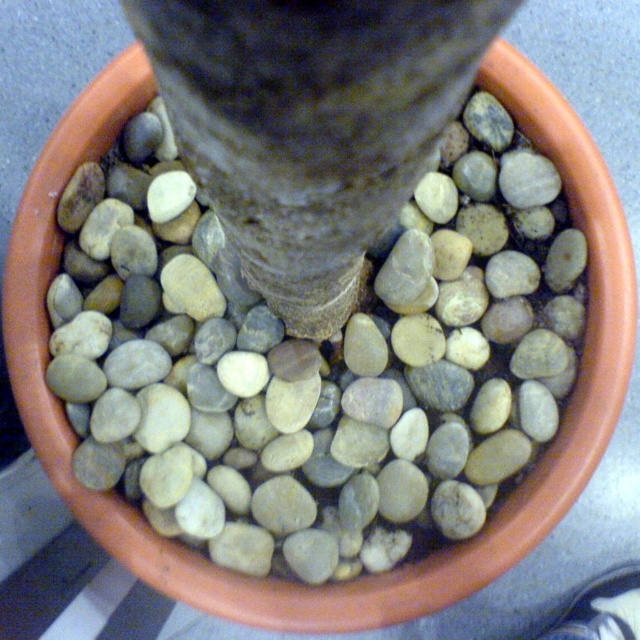
Based on the photo, you are a geologist examining the terracotta pot. You notice two objects at the center of the pot. Which one is taller, the smooth gray pebble at center or the smooth gray bark at center?

The smooth gray pebble at center is taller than the smooth gray bark at center according to the description.

You are trying to determine which object is larger between the smooth gray pebble at center and the smooth gray bark at center in the terracotta pot. Based on the scene, which one is bigger?

The smooth gray pebble at center is bigger than the smooth gray bark at center.